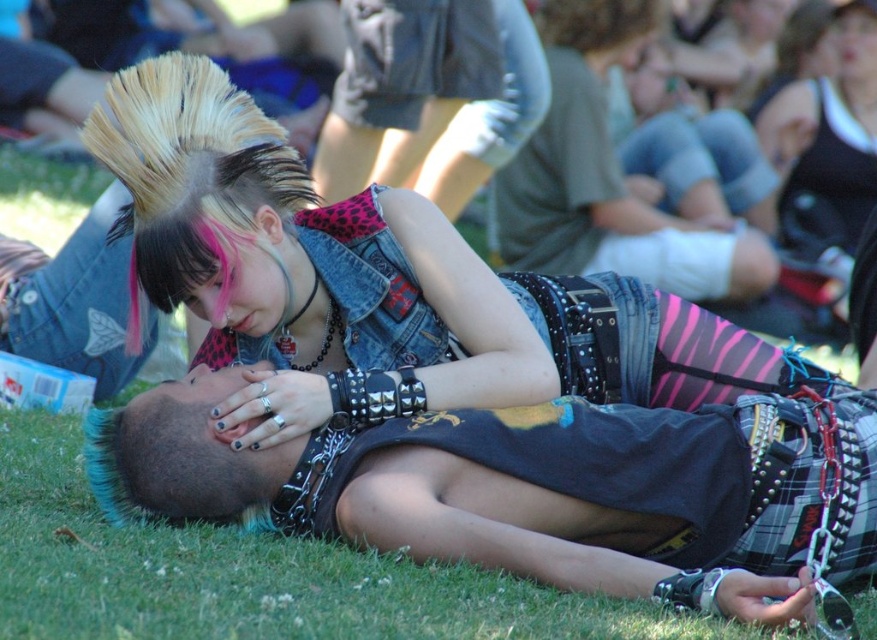
Question: Does dark gray fabric shirt at center have a smaller size compared to denim vest at center?

Choices:
 (A) yes
 (B) no

Answer: (A)

Question: Among these points, which one is nearest to the camera?

Choices:
 (A) (170, 442)
 (B) (265, 275)

Answer: (A)

Question: Estimate the real-world distances between objects in this image. Which object is farther from the denim vest at center?

Choices:
 (A) denim shorts at center
 (B) dark gray fabric shirt at center

Answer: (A)

Question: Is dark gray fabric shirt at center below denim shorts at center?

Choices:
 (A) yes
 (B) no

Answer: (A)

Question: Which point is farther to the camera?

Choices:
 (A) dark gray fabric shirt at center
 (B) denim shorts at center

Answer: (B)

Question: Is denim vest at center further to camera compared to denim shorts at center?

Choices:
 (A) yes
 (B) no

Answer: (B)